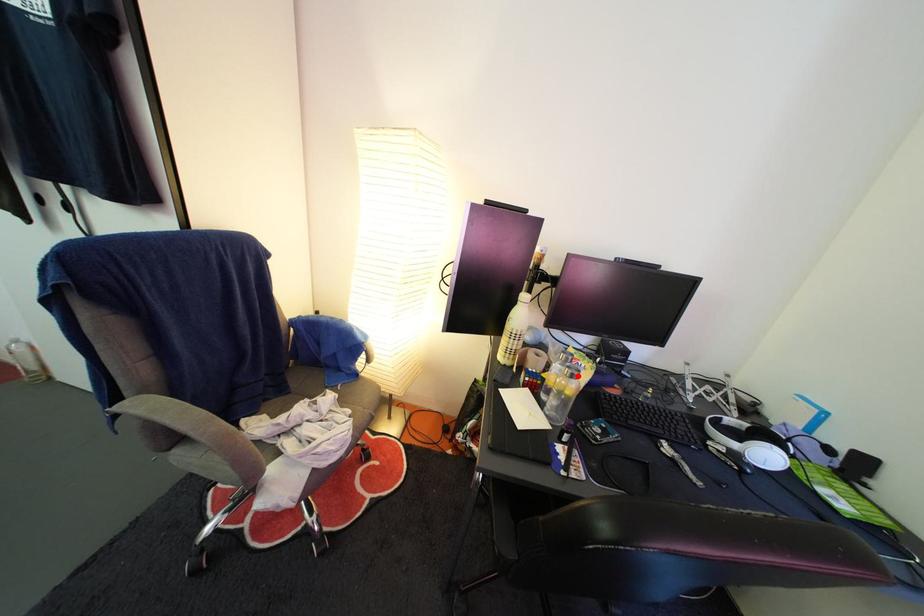
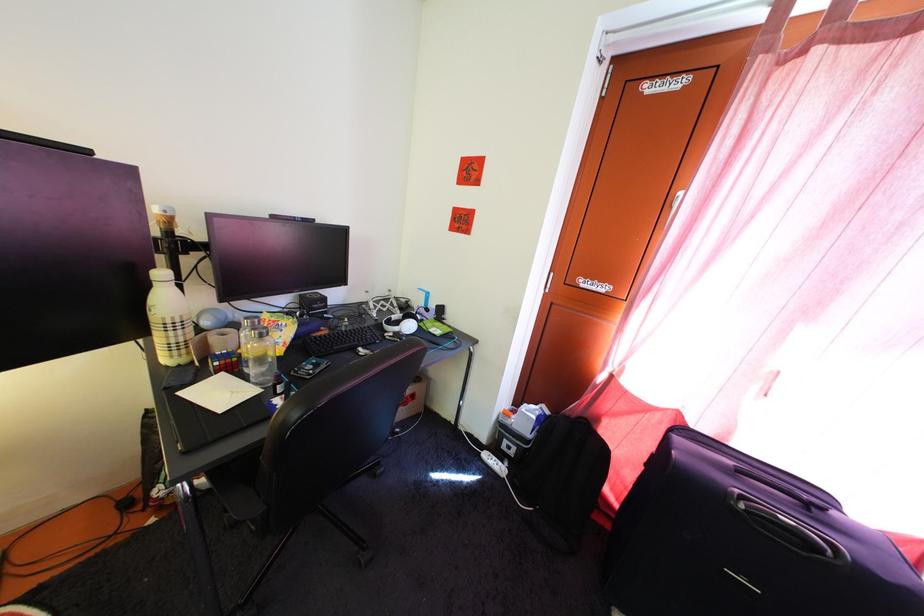
Question: I am providing you with two images of the same scene from different viewpoints. A red point is marked on the first image. Can you still see the location of the red point in image 2?

Choices:
 (A) Yes
 (B) No

Answer: (A)